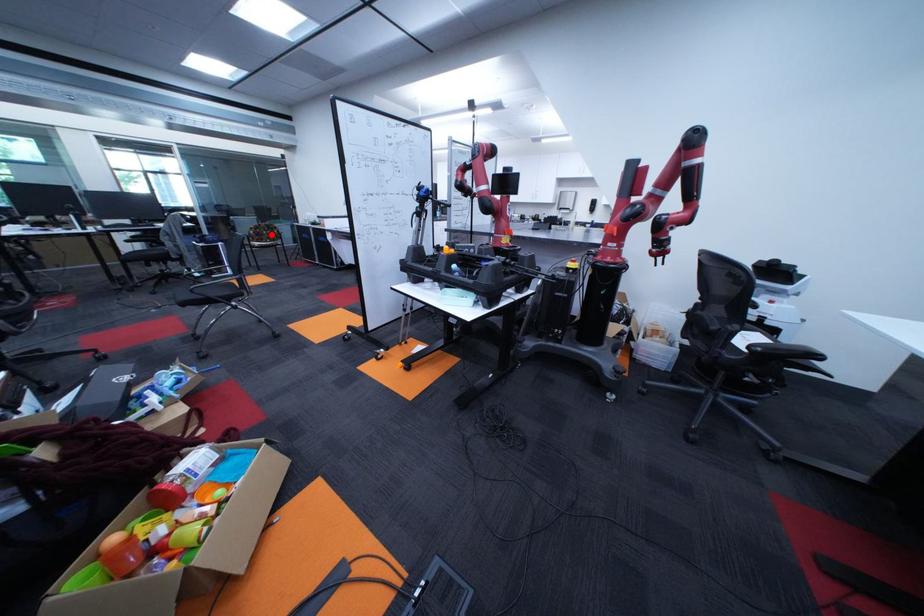
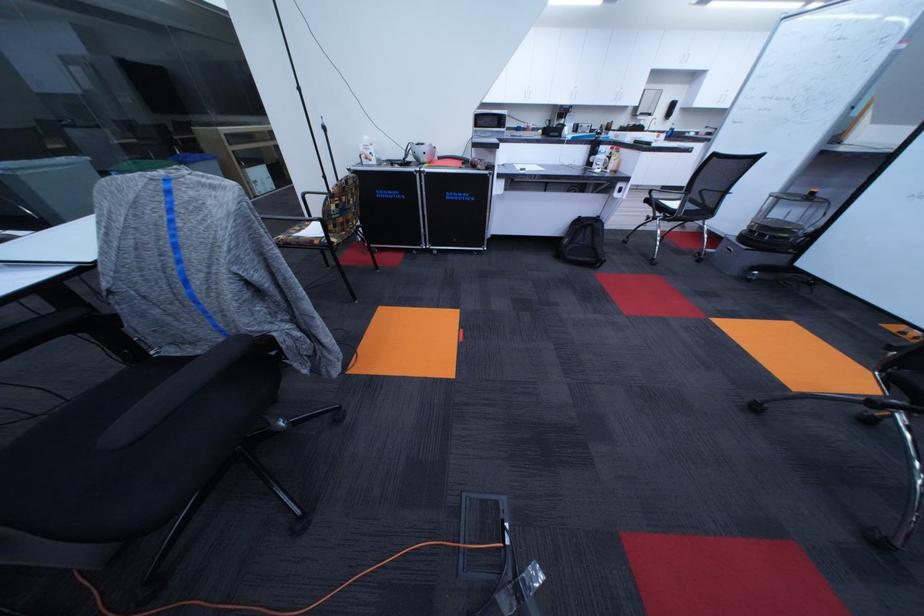
The point at the highlighted location is marked in the first image. Where is the corresponding point in the second image?

(356, 209)